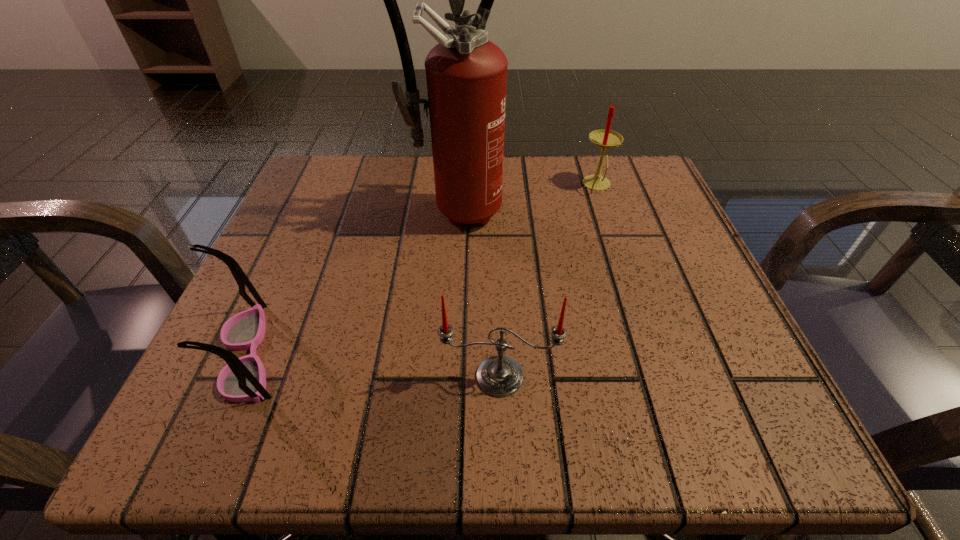
Locate an element on the screen. The width and height of the screenshot is (960, 540). blank space at the near left corner of the desktop is located at coordinates (197, 395).

I want to click on vacant space at the far right corner, so click(607, 206).

In order to click on vacant space at the near right corner of the desktop in this screenshot , I will do `click(779, 412)`.

Where is `free space that is in between the fire extinguisher and the nearer candle`? free space that is in between the fire extinguisher and the nearer candle is located at coordinates (477, 293).

You are a GUI agent. You are given a task and a screenshot of the screen. Output one action in this format:
    pyautogui.click(x=<x>, y=<y>)
    Task: Click on the unoccupied area between the rightmost object and the tallest object
    
    Given the screenshot: What is the action you would take?
    pyautogui.click(x=526, y=198)

Locate an element on the screen. Image resolution: width=960 pixels, height=540 pixels. free space between the right candle and the spectacles is located at coordinates 423,269.

Image resolution: width=960 pixels, height=540 pixels. In order to click on vacant point located between the right candle and the nearer candle in this screenshot , I will do `click(548, 281)`.

At what (x,y) coordinates should I click in order to perform the action: click on free space between the left candle and the fire extinguisher. Please return your answer as a coordinate pair (x, y). Image resolution: width=960 pixels, height=540 pixels. Looking at the image, I should click on (477, 293).

You are a GUI agent. You are given a task and a screenshot of the screen. Output one action in this format:
    pyautogui.click(x=<x>, y=<y>)
    Task: Click on the free point between the left candle and the tallest object
    Image resolution: width=960 pixels, height=540 pixels.
    Given the screenshot: What is the action you would take?
    pyautogui.click(x=477, y=293)

Where is `empty space between the rightmost object and the nearer candle`? The height and width of the screenshot is (540, 960). empty space between the rightmost object and the nearer candle is located at coordinates (548, 281).